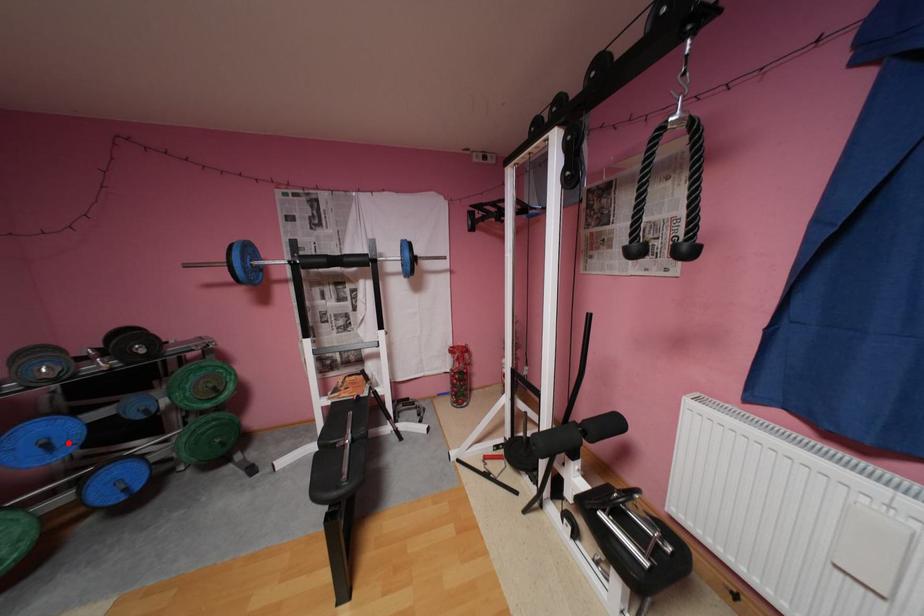
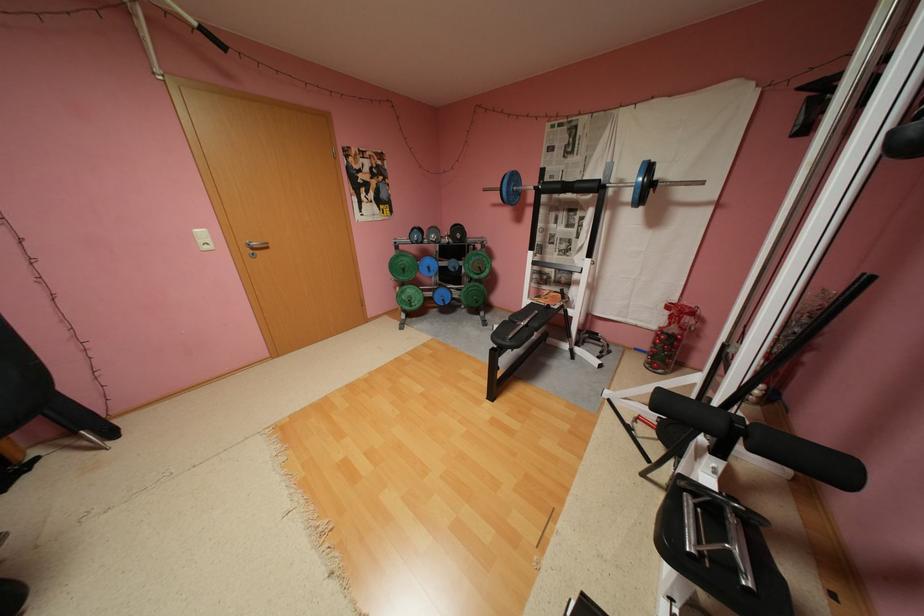
Question: I am providing you with two images of the same scene from different viewpoints. A red point is marked on the first image. Can you still see the location of the red point in image 2?

Choices:
 (A) Yes
 (B) No

Answer: (A)